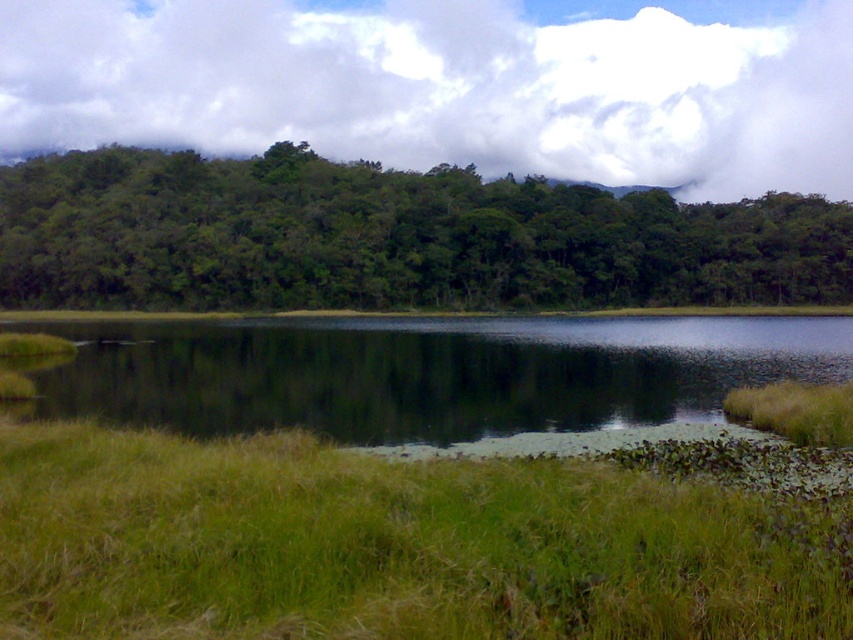
Question: Is white fluffy cloud at upper center below green leafy trees at upper center?

Choices:
 (A) yes
 (B) no

Answer: (B)

Question: Based on their relative distances, which object is nearer to the green grassy lake at center?

Choices:
 (A) green grassy at lower center
 (B) white fluffy cloud at upper center
 (C) green leafy trees at upper center

Answer: (A)

Question: Can you confirm if green grassy at lower center is positioned below green leafy trees at upper center?

Choices:
 (A) yes
 (B) no

Answer: (A)

Question: Among these points, which one is farthest from the camera?

Choices:
 (A) (90, 323)
 (B) (532, 218)
 (C) (631, 168)

Answer: (C)

Question: From the image, what is the correct spatial relationship of white fluffy cloud at upper center in relation to green grassy lake at center?

Choices:
 (A) left
 (B) right

Answer: (A)

Question: Which object is positioned closest to the white fluffy cloud at upper center?

Choices:
 (A) green grassy at lower center
 (B) green leafy trees at upper center
 (C) green grassy lake at center

Answer: (B)